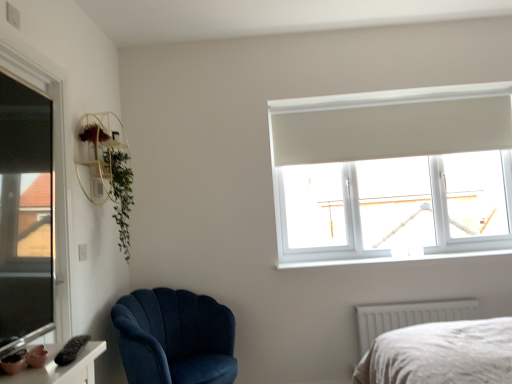
Question: Should I look upward or downward to see transparent glass window at upper right, arranged as the 2th window when viewed from the left?

Choices:
 (A) down
 (B) up

Answer: (A)

Question: Should I look upward or downward to see velvet blue armchair at lower left?

Choices:
 (A) down
 (B) up

Answer: (A)

Question: Is green leafy plant at upper left beside white plastic window sill at upper right?

Choices:
 (A) yes
 (B) no

Answer: (B)

Question: From a real-world perspective, is green leafy plant at upper left positioned over white plastic window sill at upper right based on gravity?

Choices:
 (A) yes
 (B) no

Answer: (A)

Question: Is white plastic window sill at upper right a part of green leafy plant at upper left?

Choices:
 (A) no
 (B) yes

Answer: (A)

Question: From the image's perspective, does green leafy plant at upper left appear lower than white plastic window sill at upper right?

Choices:
 (A) yes
 (B) no

Answer: (B)

Question: From a real-world perspective, is green leafy plant at upper left physically below white plastic window sill at upper right?

Choices:
 (A) no
 (B) yes

Answer: (A)

Question: Considering the relative sizes of green leafy plant at upper left and white plastic window sill at upper right in the image provided, is green leafy plant at upper left thinner than white plastic window sill at upper right?

Choices:
 (A) yes
 (B) no

Answer: (A)

Question: Does green leafy plant at upper left have a larger size compared to white textured radiator at lower right?

Choices:
 (A) no
 (B) yes

Answer: (B)

Question: Considering the relative sizes of green leafy plant at upper left and white textured radiator at lower right in the image provided, is green leafy plant at upper left taller than white textured radiator at lower right?

Choices:
 (A) no
 (B) yes

Answer: (B)

Question: From a real-world perspective, is green leafy plant at upper left located higher than white textured radiator at lower right?

Choices:
 (A) no
 (B) yes

Answer: (B)

Question: Can you confirm if green leafy plant at upper left is smaller than white textured radiator at lower right?

Choices:
 (A) no
 (B) yes

Answer: (A)

Question: Could you tell me if green leafy plant at upper left is facing white textured radiator at lower right?

Choices:
 (A) yes
 (B) no

Answer: (B)

Question: From the image's perspective, would you say green leafy plant at upper left is positioned over white textured radiator at lower right?

Choices:
 (A) yes
 (B) no

Answer: (A)

Question: From a real-world perspective, is matte pink ceramic at lower left over white plastic window sill at upper right?

Choices:
 (A) yes
 (B) no

Answer: (A)